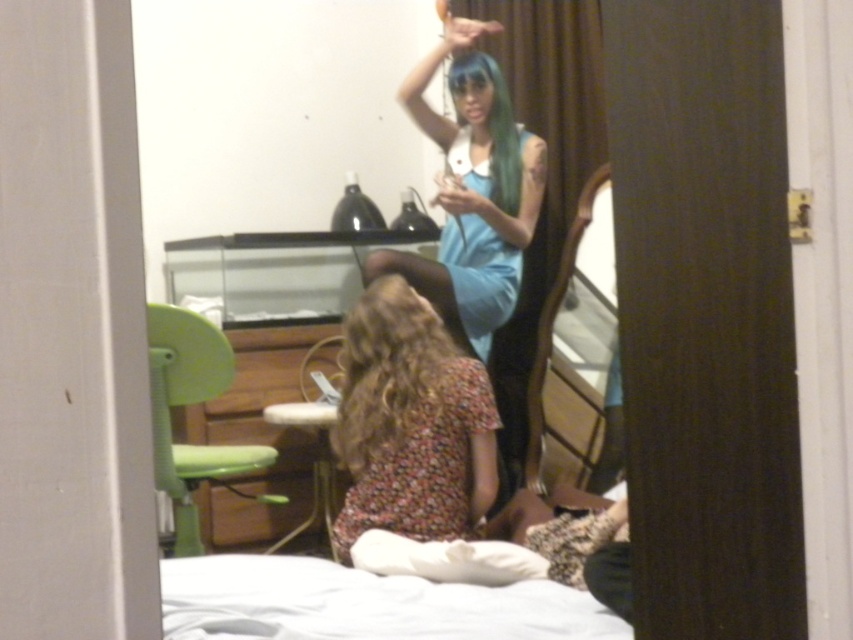
Question: Can you confirm if white soft bed at lower center is thinner than wooden mirror at center?

Choices:
 (A) yes
 (B) no

Answer: (B)

Question: Among these objects, which one is nearest to the camera?

Choices:
 (A) white soft bed at lower center
 (B) wooden mirror at center
 (C) floral fabric dress at center

Answer: (A)

Question: Is floral fabric dress at center positioned at the back of wooden mirror at center?

Choices:
 (A) yes
 (B) no

Answer: (B)

Question: Which of the following is the closest to the observer?

Choices:
 (A) (566, 256)
 (B) (355, 346)
 (C) (492, 160)
 (D) (476, 307)

Answer: (B)

Question: Is curly brown hair at lower center closer to camera compared to wooden mirror at center?

Choices:
 (A) no
 (B) yes

Answer: (B)

Question: Which point appears farthest from the camera in this image?

Choices:
 (A) (489, 113)
 (B) (473, 154)
 (C) (607, 170)
 (D) (332, 632)

Answer: (B)